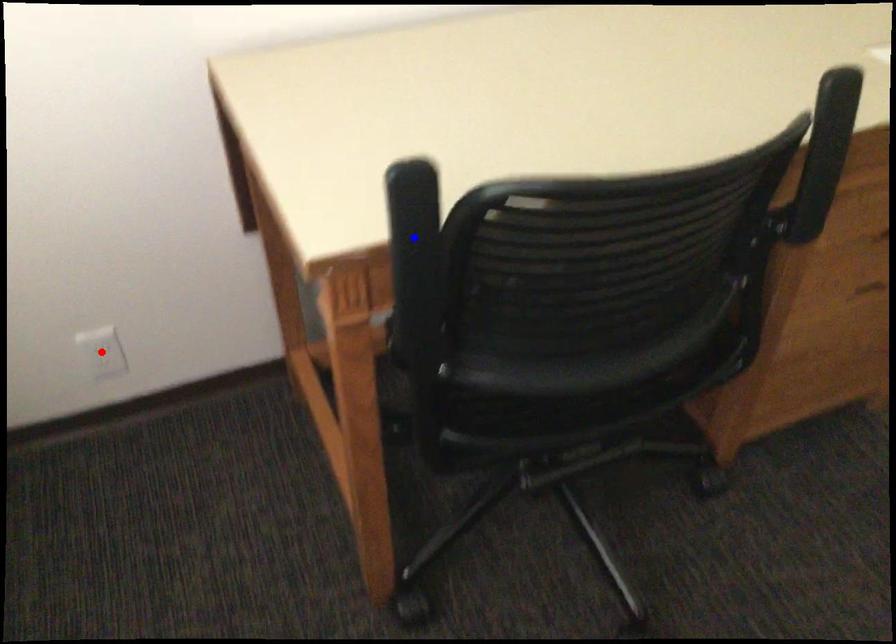
Question: Two points are marked on the image. Which point is closer to the camera?

Choices:
 (A) Blue point is closer.
 (B) Red point is closer.

Answer: (A)